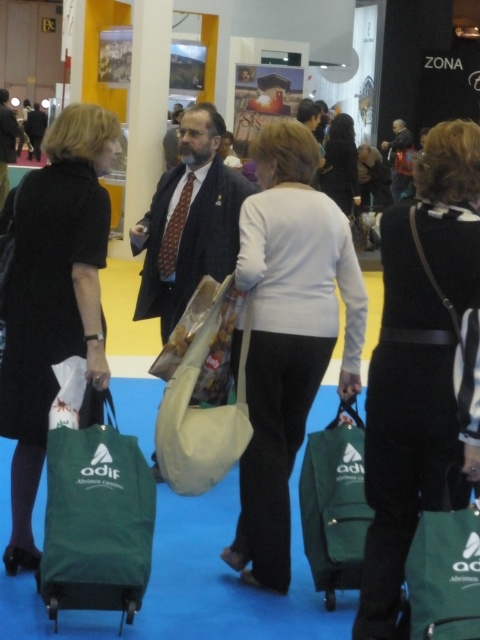
Is green fabric bag at lower left smaller than matte black dress at left?

Yes.

Is green fabric bag at lower left taller than matte black dress at left?

No, green fabric bag at lower left is not taller than matte black dress at left.

Identify the location of green fabric bag at lower left. Image resolution: width=480 pixels, height=640 pixels. (96, 515).

Who is positioned more to the right, matte beige bag at center or matte black dress at left?

matte beige bag at center

How far apart are matte beige bag at center and matte black dress at left?

36.45 feet

Who is more distant from viewer, (210, 218) or (12, 156)?

The point (12, 156) is behind.

Where is `matte beige bag at center`? The width and height of the screenshot is (480, 640). matte beige bag at center is located at coordinates (189, 221).

Who is higher up, white matte bag at center or green fabric bag at lower left?

white matte bag at center

Between point (262, 554) and point (96, 508), which one is positioned in front?

Point (96, 508)

Who is more forward, (x=276, y=160) or (x=97, y=532)?

Positioned in front is point (x=97, y=532).

I want to click on white matte bag at center, so click(x=288, y=333).